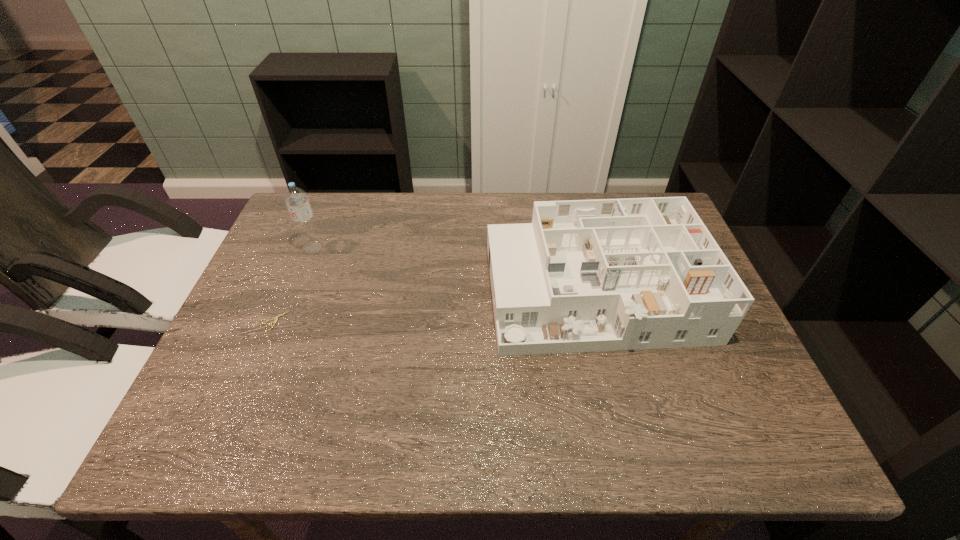
This screenshot has width=960, height=540. I want to click on the tallest object, so click(296, 199).

At what (x,y) coordinates should I click in order to perform the action: click on dollhouse. Please return your answer as a coordinate pair (x, y). Looking at the image, I should click on (638, 273).

Image resolution: width=960 pixels, height=540 pixels. In order to click on the rightmost object in this screenshot , I will do (638, 273).

At what (x,y) coordinates should I click in order to perform the action: click on shears. Please return your answer as a coordinate pair (x, y). This screenshot has height=540, width=960. Looking at the image, I should click on (275, 319).

Where is `vacant space situated on the front of the water bottle`? The image size is (960, 540). vacant space situated on the front of the water bottle is located at coordinates (295, 294).

I want to click on vacant space situated 0.230m on the left of the rightmost object, so click(399, 292).

Where is `free point located on the front of the shears`? This screenshot has height=540, width=960. free point located on the front of the shears is located at coordinates (221, 447).

I want to click on water bottle that is positioned at the left edge, so click(x=296, y=199).

In order to click on shears that is at the left edge in this screenshot , I will do point(275,319).

Image resolution: width=960 pixels, height=540 pixels. In order to click on object located in the right edge section of the desktop in this screenshot , I will do `click(638, 273)`.